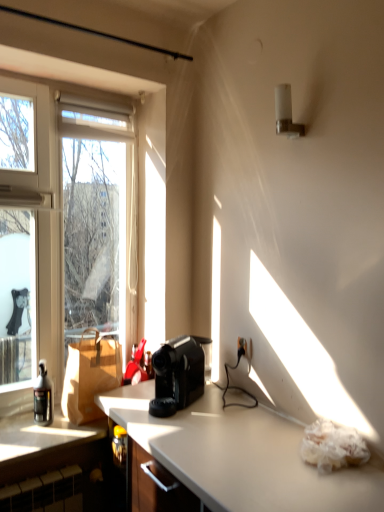
Question: Is brown paper bag at left inside the boundaries of metallic silver cabinet at left, or outside?

Choices:
 (A) inside
 (B) outside

Answer: (B)

Question: Considering the positions of point (87, 412) and point (44, 430), is point (87, 412) closer or farther from the camera than point (44, 430)?

Choices:
 (A) farther
 (B) closer

Answer: (A)

Question: Which object is the farthest from the white frosted glass at upper right?

Choices:
 (A) black plastic coffee maker at center
 (B) transparent glass window at left
 (C) translucent glass bottle at left
 (D) metallic silver cabinet at left
 (E) brown paper bag at left

Answer: (D)

Question: Estimate the real-world distances between objects in this image. Which object is farther from the transparent glass window at left?

Choices:
 (A) brown paper bag at left
 (B) metallic silver cabinet at left
 (C) black plastic coffee maker at center
 (D) translucent glass bottle at left
 (E) white frosted glass at upper right

Answer: (E)